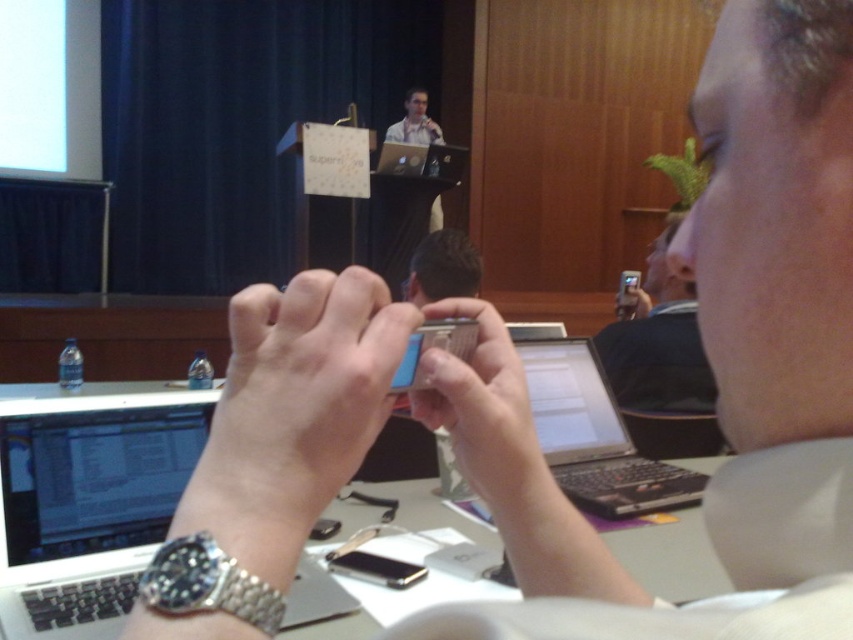
Looking at this image, you are attending a workshop and need to reach for your metallic silver phone at center to take a photo. However, there is a white matte laptop at lower left in the way. Can you move the laptop to the right to clear space for the phone?

The white matte laptop at lower left is to the left of the metallic silver phone at center, so moving it to the right would clear space for the phone.